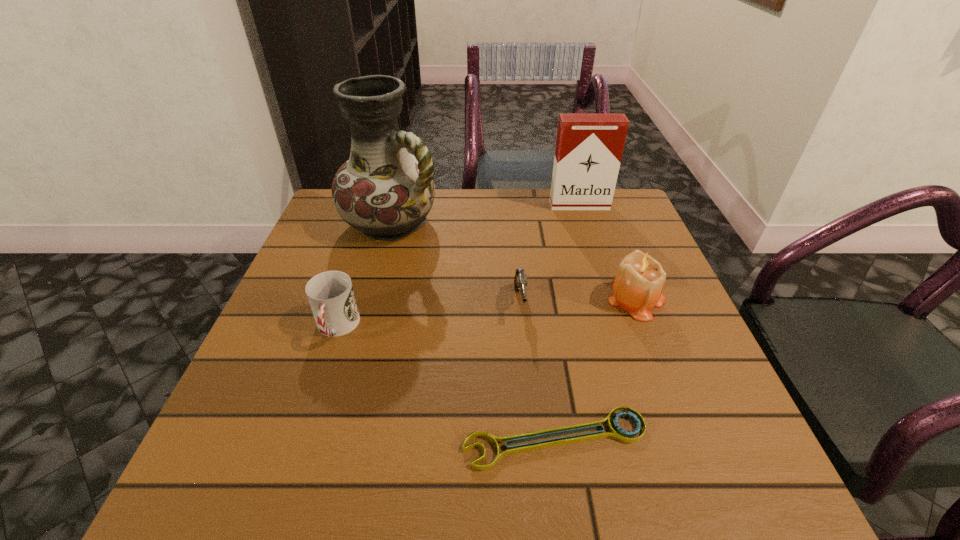
This screenshot has width=960, height=540. Identify the location of wrench that is at the right edge. (616, 432).

Locate an element on the screen. The width and height of the screenshot is (960, 540). object that is at the far left corner is located at coordinates (383, 191).

Identify the location of object located in the far right corner section of the desktop. The height and width of the screenshot is (540, 960). (589, 147).

Find the location of a particular element. object that is at the near right corner is located at coordinates (616, 432).

In the image, there is a desktop. Where is `free space at the far edge`? free space at the far edge is located at coordinates (481, 229).

At what (x,y) coordinates should I click in order to perform the action: click on free location at the near edge of the desktop. Please return your answer as a coordinate pair (x, y). The image size is (960, 540). Looking at the image, I should click on (338, 501).

The image size is (960, 540). What are the coordinates of `vacant point at the left edge` in the screenshot? It's located at (304, 352).

Locate an element on the screen. The height and width of the screenshot is (540, 960). vacant space at the right edge of the desktop is located at coordinates (684, 370).

Locate an element on the screen. free point at the near left corner is located at coordinates (307, 464).

In order to click on free space at the far right corner of the desktop in this screenshot , I will do `click(604, 214)`.